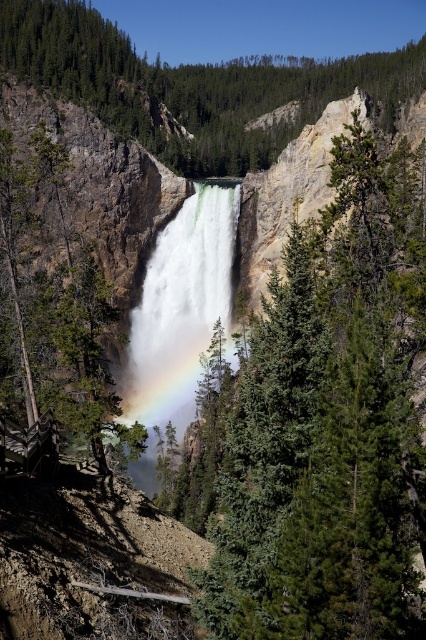
You are standing at the base of the waterfall and notice a point marked at coordinates (328,424). According to the scene description, what object is located at that point?

The point at coordinates (328,424) corresponds to the green matte tree at center.

You are standing at the center of the waterfall scene. Looking towards the green matte tree at left, can you estimate its position relative to your current viewpoint?

The green matte tree at left is located at coordinates approximately 0.483 along the horizontal axis and 0.113 along the vertical axis from the center of the scene.